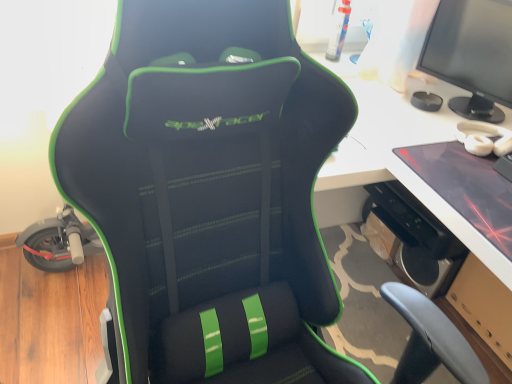
Locate an element on the screen. The height and width of the screenshot is (384, 512). free point behind matte black laptop at right is located at coordinates pos(417,109).